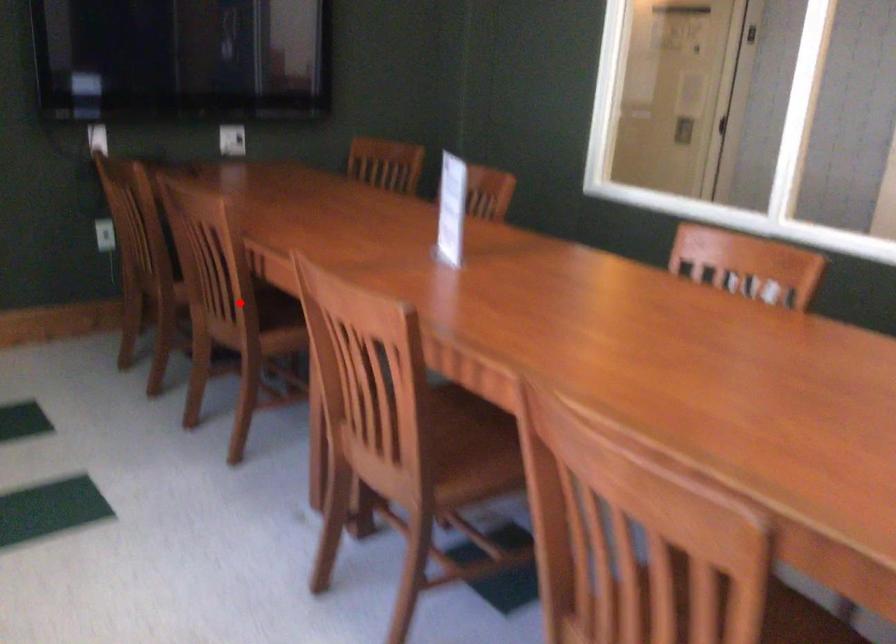
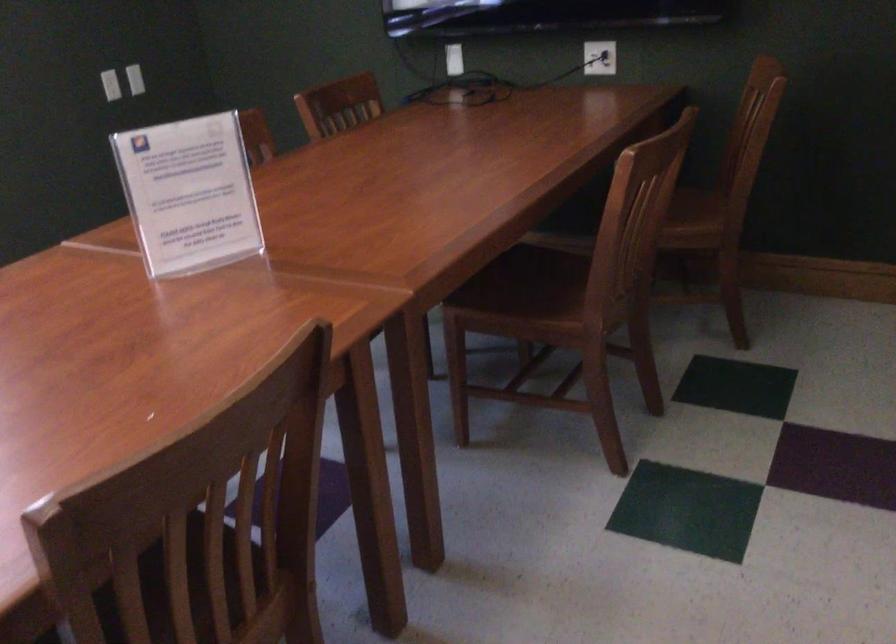
Question: I am providing you with two images of the same scene from different viewpoints. A red point is marked on the first image. At the location where the point appears in image 1, is it still visible in image 2?

Choices:
 (A) Yes
 (B) No

Answer: (B)